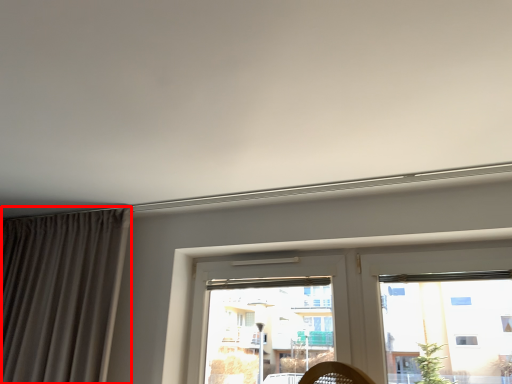
Question: From the image's perspective, where is curtain (annotated by the red box) located in relation to window in the image?

Choices:
 (A) above
 (B) below

Answer: (A)